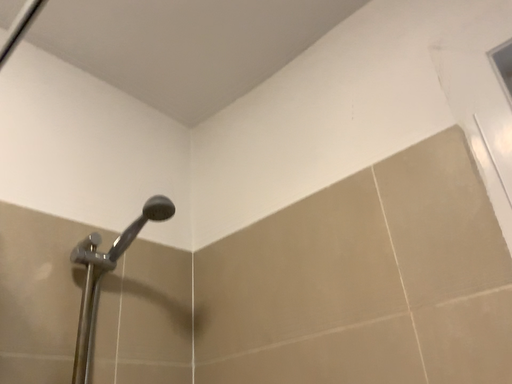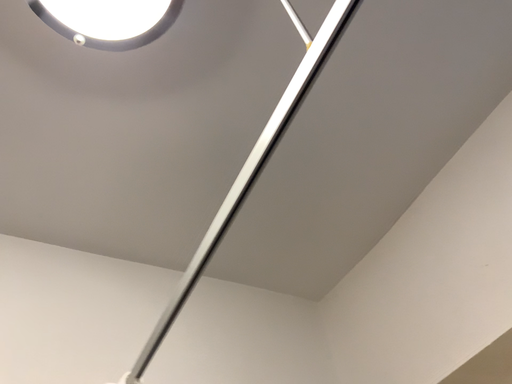
Question: How did the camera likely rotate when shooting the video?

Choices:
 (A) rotated upward
 (B) rotated downward

Answer: (A)